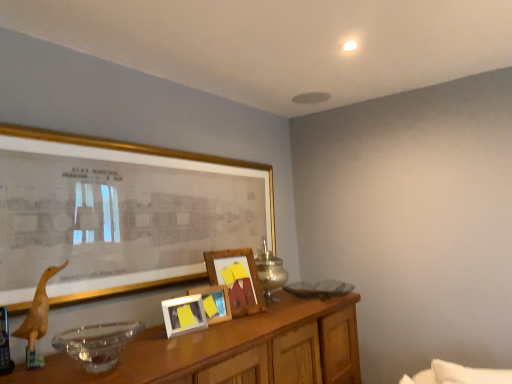
Image resolution: width=512 pixels, height=384 pixels. Find the location of `vacant area to the right of wooden picture frame at center, the third picture frame positioned from the front`. vacant area to the right of wooden picture frame at center, the third picture frame positioned from the front is located at coordinates (241, 313).